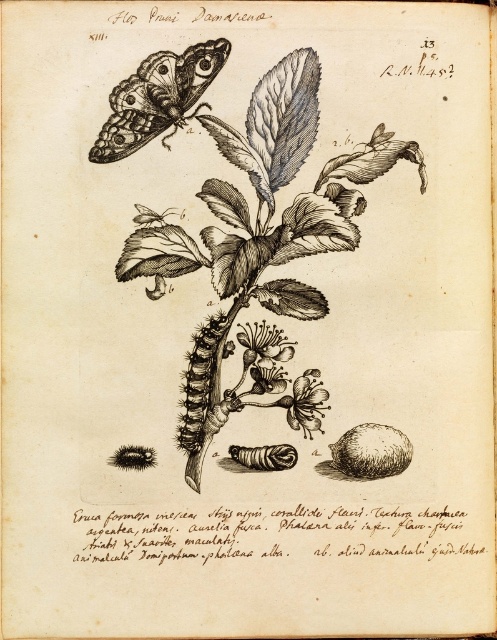
Question: Is smooth brown stem at center in front of smooth white flower at center?

Choices:
 (A) no
 (B) yes

Answer: (B)

Question: Which object is farther from the camera taking this photo?

Choices:
 (A) smooth brown stem at center
 (B) dark brown fuzzy caterpillar at center
 (C) smooth white flower at center
 (D) shiny black butterfly at upper left

Answer: (C)

Question: Among these objects, which one is nearest to the camera?

Choices:
 (A) shiny black butterfly at upper left
 (B) dark brown fuzzy caterpillar at center
 (C) smooth brown stem at center

Answer: (A)

Question: Can you confirm if smooth brown stem at center is smaller than shiny black butterfly at upper left?

Choices:
 (A) no
 (B) yes

Answer: (A)

Question: Can you confirm if shiny black butterfly at upper left is positioned to the left of smooth white flower at center?

Choices:
 (A) no
 (B) yes

Answer: (B)

Question: Which of these objects is positioned closest to the shiny black butterfly at upper left?

Choices:
 (A) dark brown fuzzy caterpillar at center
 (B) smooth white flower at center

Answer: (A)